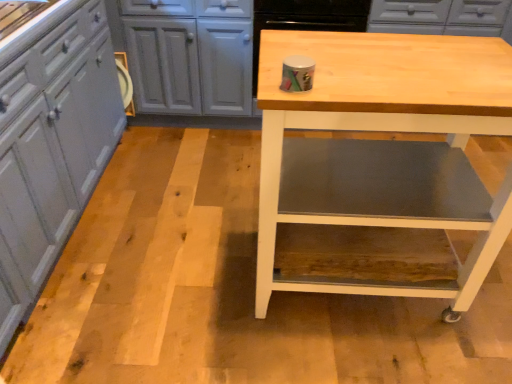
Question: Should I look upward or downward to see matte gray cabinets at left?

Choices:
 (A) down
 (B) up

Answer: (B)

Question: From a real-world perspective, is matte gray cabinets at left physically above natural wood table at center?

Choices:
 (A) no
 (B) yes

Answer: (A)

Question: Does matte gray cabinets at left have a smaller size compared to natural wood table at center?

Choices:
 (A) yes
 (B) no

Answer: (B)

Question: Is matte gray cabinets at left at the right side of natural wood table at center?

Choices:
 (A) no
 (B) yes

Answer: (A)

Question: Is matte gray cabinets at left positioned far away from natural wood table at center?

Choices:
 (A) no
 (B) yes

Answer: (B)

Question: Is matte gray cabinets at left closer to the viewer compared to natural wood table at center?

Choices:
 (A) no
 (B) yes

Answer: (B)

Question: Considering the relative sizes of matte gray cabinets at left and natural wood table at center in the image provided, is matte gray cabinets at left bigger than natural wood table at center?

Choices:
 (A) no
 (B) yes

Answer: (B)

Question: Can you see natural wood table at center touching matte gray cabinets at left?

Choices:
 (A) no
 (B) yes

Answer: (A)

Question: Considering the relative sizes of natural wood table at center and matte gray cabinets at left in the image provided, is natural wood table at center bigger than matte gray cabinets at left?

Choices:
 (A) no
 (B) yes

Answer: (A)

Question: Is natural wood table at center to the right of matte gray cabinets at left from the viewer's perspective?

Choices:
 (A) yes
 (B) no

Answer: (A)

Question: Considering the relative sizes of natural wood table at center and matte gray cabinets at left in the image provided, is natural wood table at center taller than matte gray cabinets at left?

Choices:
 (A) yes
 (B) no

Answer: (B)

Question: Is natural wood table at center behind matte gray cabinets at left?

Choices:
 (A) yes
 (B) no

Answer: (A)

Question: Is natural wood table at center located outside matte gray cabinets at left?

Choices:
 (A) no
 (B) yes

Answer: (B)

Question: Considering the positions of point (56, 188) and point (463, 39), is point (56, 188) closer or farther from the camera than point (463, 39)?

Choices:
 (A) farther
 (B) closer

Answer: (A)